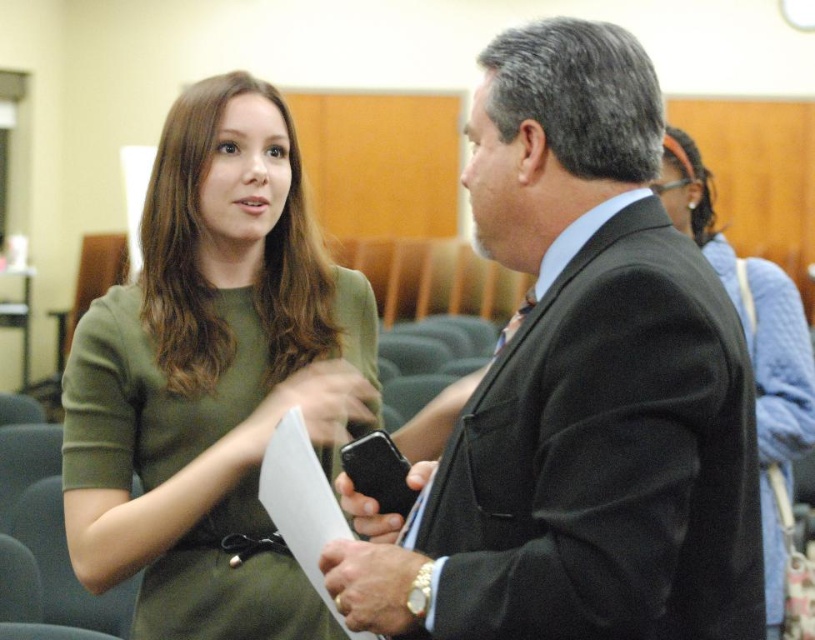
You are designing a layout for a meeting room and need to ensure that the green matte dress at upper left is visible from the entrance. Based on its coordinates at point 0.591, 0.261, can you confirm if it is positioned in a central area of the room?

The green matte dress at upper left is located at coordinates [212,378], which typically places it in the central area of the room, making it visible from the entrance.

You are an interior designer planning to place a small decorative item at the coordinates point (x=212, y=378). Based on the scene description, where exactly would this point be located?

The point (x=212, y=378) is located on the green matte dress at upper left.